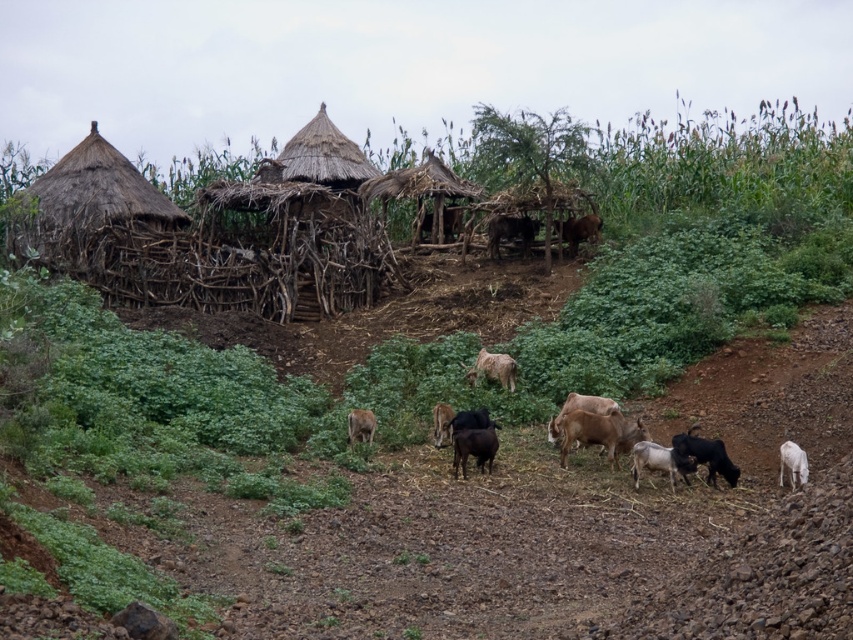
Who is higher up, black fur goat at center or black woolly goat at center?

black woolly goat at center is higher up.

Who is positioned more to the left, black fur goat at center or black woolly goat at center?

From the viewer's perspective, black woolly goat at center appears more on the left side.

Is point (468, 452) positioned in front of point (434, 436)?

Yes, it is in front of point (434, 436).

This screenshot has width=853, height=640. I want to click on black fur goat at center, so click(473, 448).

Between thatched wood huts at upper left and black woolen goat at lower right, which one has more height?

With more height is thatched wood huts at upper left.

Which is more to the right, thatched wood huts at upper left or black woolen goat at lower right?

Positioned to the right is black woolen goat at lower right.

This screenshot has height=640, width=853. What do you see at coordinates (228, 227) in the screenshot?
I see `thatched wood huts at upper left` at bounding box center [228, 227].

The height and width of the screenshot is (640, 853). I want to click on thatched wood huts at upper left, so click(x=228, y=227).

Can you confirm if brown fur goat at center is positioned to the right of white woolen goat at lower right?

No, brown fur goat at center is not to the right of white woolen goat at lower right.

Which is in front, point (503, 230) or point (787, 442)?

Point (787, 442)

Does point (490, 248) lie in front of point (791, 458)?

No, (490, 248) is further to viewer.

The image size is (853, 640). In order to click on brown fur goat at center in this screenshot , I will do `click(509, 232)`.